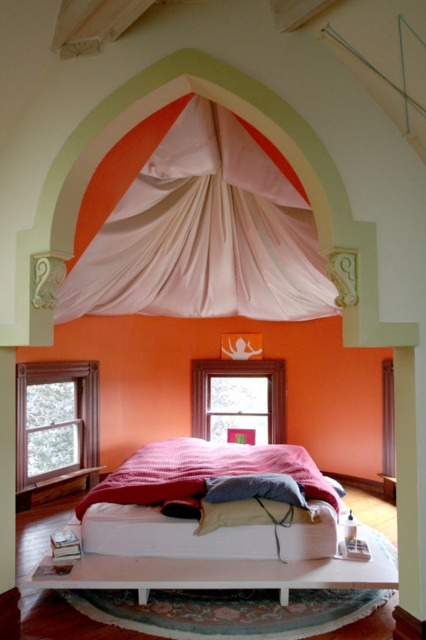
You are standing in the bedroom and want to look out the matte wooden window at center. Which direction should you face to see the matte white bed at center from the window?

The matte white bed at center is located below the matte wooden window at center, so facing downward from the window would allow you to see the matte white bed at center.